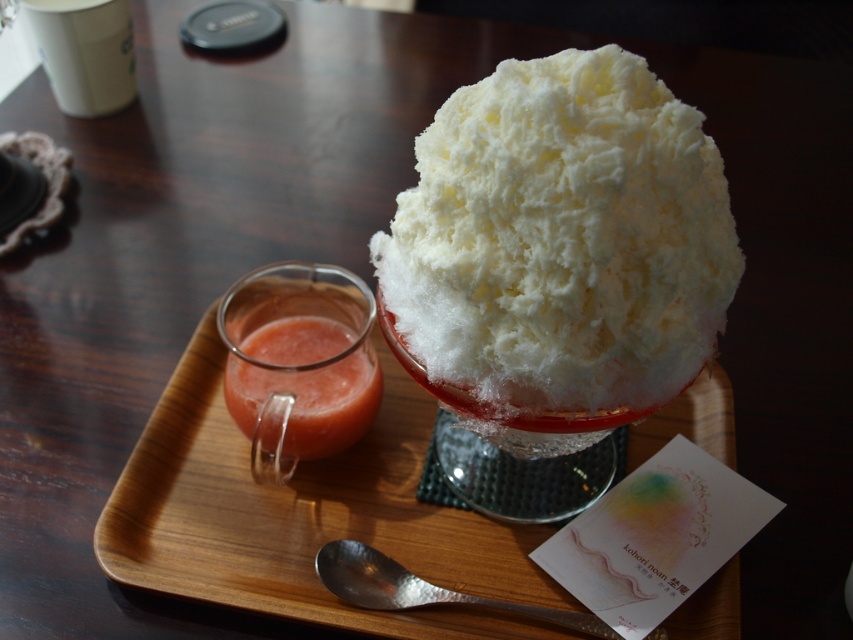
You are a customer at a dessert shop and see the image. You want to reach for the translucent glass juice at upper left but need to pick up the silver hammered spoon at lower center first. Is the spoon under the juice glass?

The translucent glass juice at upper left is positioned over the silver hammered spoon at lower center, so yes, the spoon is under the juice glass.

You are at a dessert shop and want to know which item takes up more space on the wooden tray. Which one is larger in size between the white fluffy shaved ice at center and the translucent glass juice at upper left?

The white fluffy shaved ice at center is bigger than the translucent glass juice at upper left, so it takes up more space on the wooden tray.